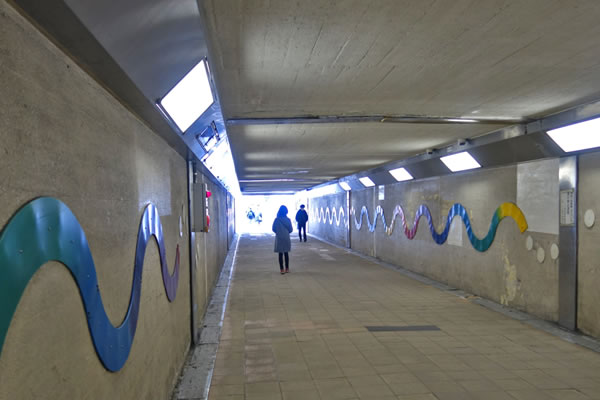
Where is `row of lights`? row of lights is located at coordinates (151, 53), (546, 144).